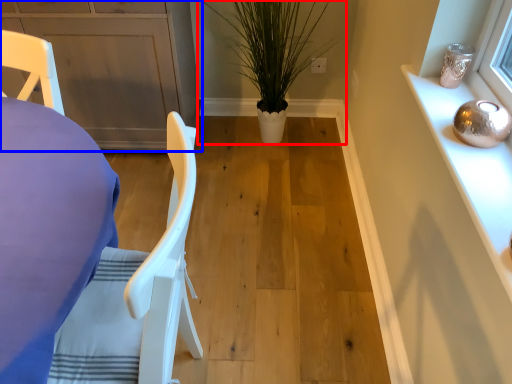
Question: Which point is further to the camera, houseplant (highlighted by a red box) or cabinetry (highlighted by a blue box)?

Choices:
 (A) houseplant
 (B) cabinetry

Answer: (B)